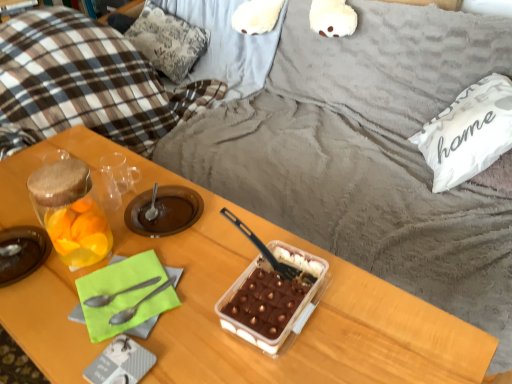
Identify the location of free space to the back side of silver metallic spoon at center, the second spoon when ordered from left to right. (162, 242).